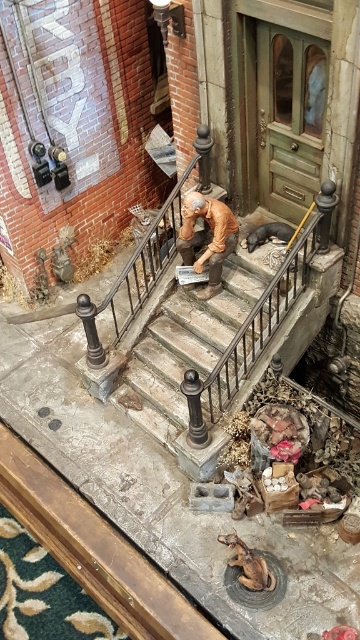
You are a delivery person trying to reach the matte brown figure at center sitting on the steps. There is a brown leather dog at lower center in your path. Given that the dog is 3.40 meters away from the figure, can you safely walk around the dog to reach your destination without getting too close?

The matte brown figure at center and brown leather dog at lower center are 3.40 meters apart. Since the dog is 3.40 meters away from the figure, you can safely walk around the dog while maintaining a safe distance to reach the matte brown figure at center.

Looking at this image, you are a delivery person trying to determine the best path to avoid stepping on the brown leather dog at lower center while approaching the matte brown figure at center. Based on their sizes, which object should you adjust your path around more?

The matte brown figure at center is taller than the brown leather dog at lower center, so you should adjust your path around the brown leather dog at lower center since it is closer to the ground and might be in your way.